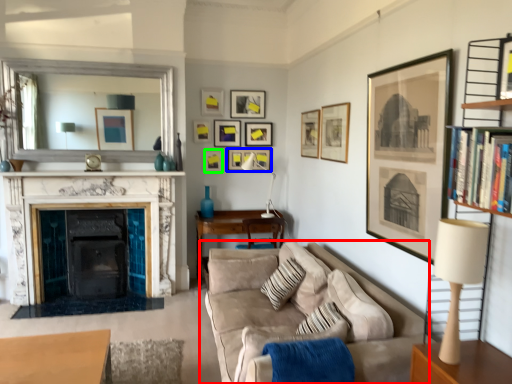
Question: Estimate the real-world distances between objects in this image. Which object is closer to studio couch (highlighted by a red box), picture frame (highlighted by a blue box) or picture frame (highlighted by a green box)?

Choices:
 (A) picture frame
 (B) picture frame

Answer: (B)